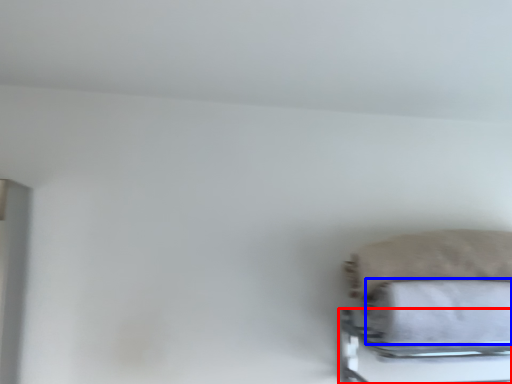
Question: Among these objects, which one is nearest to the camera, bed frame (highlighted by a red box) or bath towel (highlighted by a blue box)?

Choices:
 (A) bed frame
 (B) bath towel

Answer: (A)